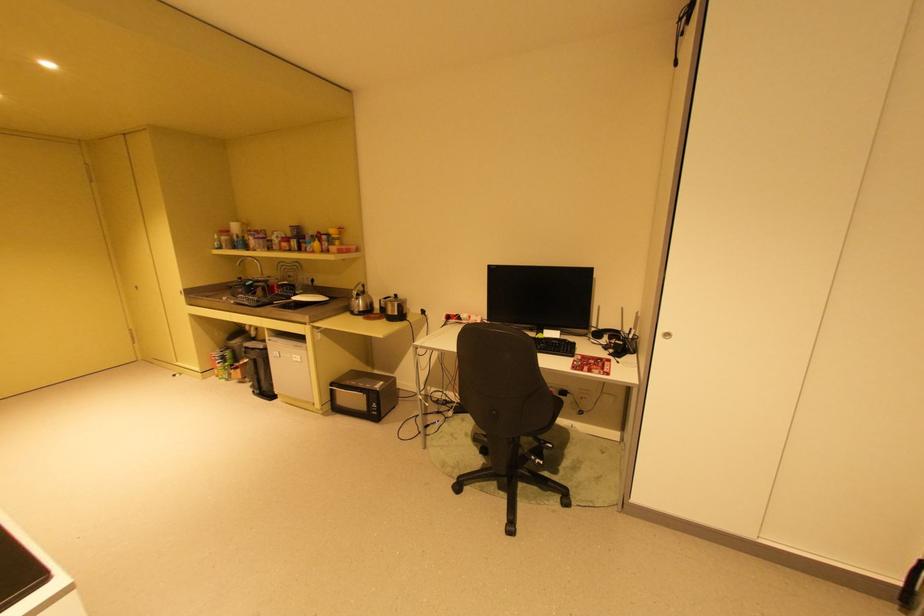
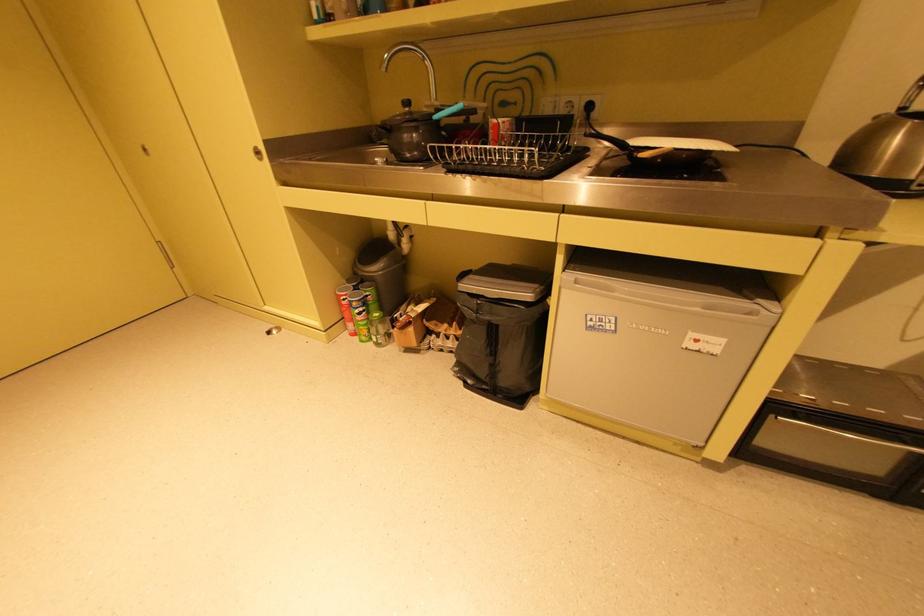
What movement of the cameraman would produce the second image?

The cameraman walked toward left, forward.